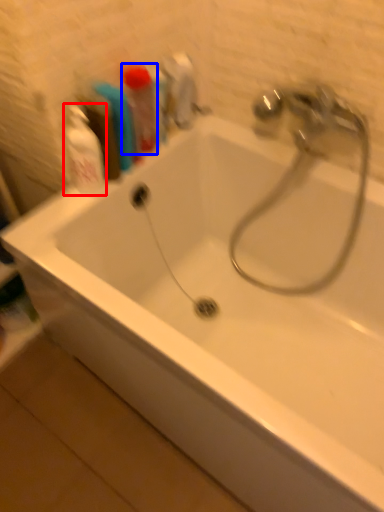
Question: Which object is closer to the camera taking this photo, cleaning product (highlighted by a red box) or toiletry (highlighted by a blue box)?

Choices:
 (A) cleaning product
 (B) toiletry

Answer: (A)